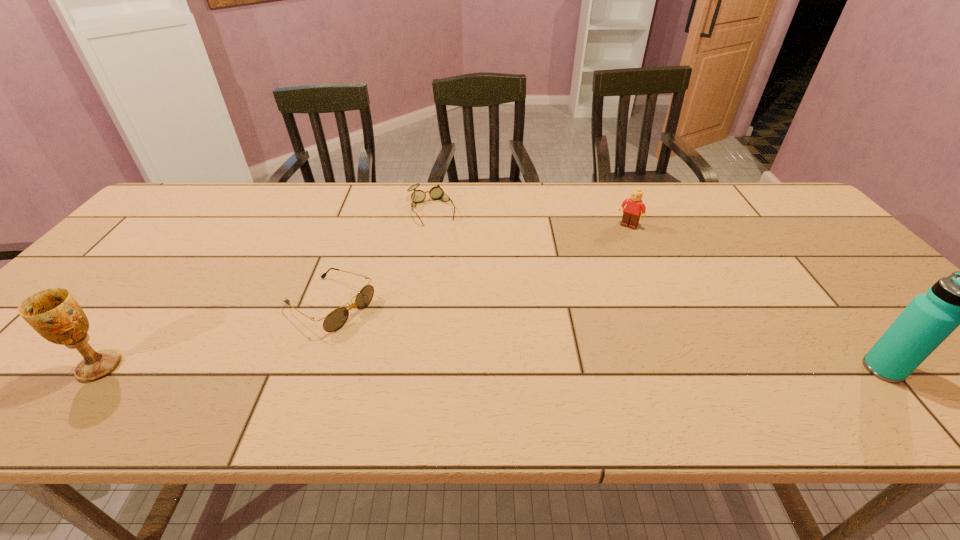
Find the location of a particular element. The height and width of the screenshot is (540, 960). vacant space located 0.400m on the back of the leftmost object is located at coordinates pyautogui.click(x=200, y=242).

The image size is (960, 540). I want to click on free location located on the left of the tallest object, so click(704, 369).

At what (x,y) coordinates should I click in order to perform the action: click on free point located 0.100m on the front-facing side of the third nearest object. Please return your answer as a coordinate pair (x, y). The height and width of the screenshot is (540, 960). Looking at the image, I should click on (394, 341).

This screenshot has height=540, width=960. I want to click on vacant region located 0.180m on the front-facing side of the third nearest object, so click(421, 357).

Locate an element on the screen. The height and width of the screenshot is (540, 960). vacant space located on the front-facing side of the third nearest object is located at coordinates (414, 353).

This screenshot has height=540, width=960. In order to click on vacant area situated on the face of the Lego in this screenshot , I will do `click(579, 296)`.

The width and height of the screenshot is (960, 540). Find the location of `vacant position located 0.290m on the face of the Lego`. vacant position located 0.290m on the face of the Lego is located at coordinates tap(587, 285).

Locate an element on the screen. The image size is (960, 540). vacant area situated on the face of the Lego is located at coordinates (605, 258).

Locate an element on the screen. This screenshot has width=960, height=540. free region located 0.090m on the front-facing side of the third object from right to left is located at coordinates (444, 242).

This screenshot has width=960, height=540. What are the coordinates of `vacant space positioned 0.250m on the front-facing side of the third object from right to left` in the screenshot? It's located at (461, 278).